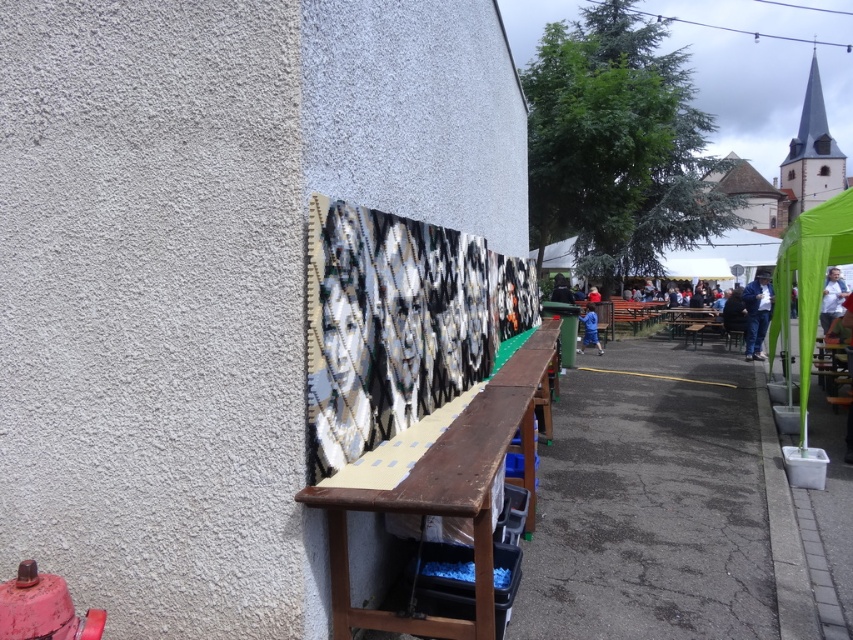
Can you confirm if black and white woven tapestry at center is positioned to the right of white fabric at right?

Incorrect, black and white woven tapestry at center is not on the right side of white fabric at right.

What do you see at coordinates (398, 323) in the screenshot? This screenshot has width=853, height=640. I see `black and white woven tapestry at center` at bounding box center [398, 323].

The height and width of the screenshot is (640, 853). I want to click on black and white woven tapestry at center, so click(398, 323).

Is point (329, 212) positioned after point (796, 230)?

No, (329, 212) is closer to viewer.

Where is `black and white woven tapestry at center`? black and white woven tapestry at center is located at coordinates (398, 323).

In order to click on black and white woven tapestry at center in this screenshot , I will do `click(398, 323)`.

Does white fabric at right have a lesser height compared to blue fabric at center?

No.

Between white fabric at right and blue fabric at center, which one is positioned lower?

blue fabric at center

The width and height of the screenshot is (853, 640). What do you see at coordinates (833, 298) in the screenshot?
I see `white fabric at right` at bounding box center [833, 298].

Where is `white fabric at right`? This screenshot has width=853, height=640. white fabric at right is located at coordinates (833, 298).